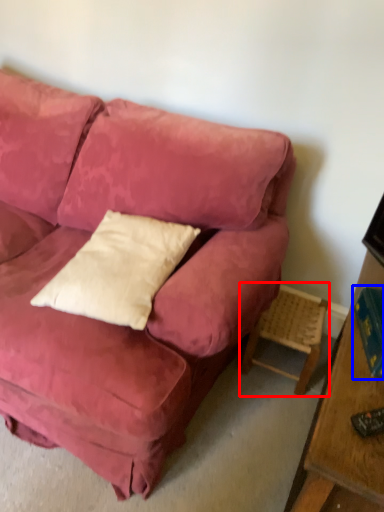
Question: Which of the following is the farthest to the observer, side table (highlighted by a red box) or book (highlighted by a blue box)?

Choices:
 (A) side table
 (B) book

Answer: (A)